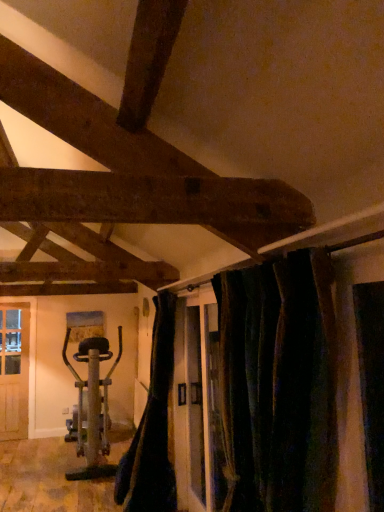
Question: Based on their sizes in the image, would you say metallic silver exercise bike at left is bigger or smaller than black fabric curtain at lower center, which appears as the second curtain when viewed from the right?

Choices:
 (A) big
 (B) small

Answer: (A)

Question: Is metallic silver exercise bike at left wider or thinner than black fabric curtain at lower center, placed as the first curtain when sorted from left to right?

Choices:
 (A) wide
 (B) thin

Answer: (A)

Question: Which is farther from the metallic silver exercise bike at left?

Choices:
 (A) dark velvet curtains at center, which is the 1th curtain from front to back
 (B) black fabric curtain at lower center, placed as the first curtain when sorted from left to right

Answer: (A)

Question: Considering the real-world distances, which object is closest to the metallic silver exercise bike at left?

Choices:
 (A) black fabric curtain at lower center, placed as the first curtain when sorted from left to right
 (B) dark velvet curtains at center, arranged as the second curtain when viewed from the back

Answer: (A)